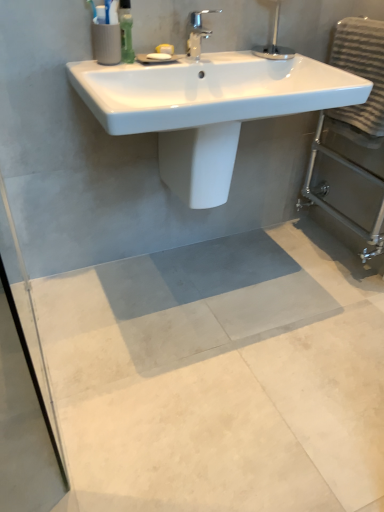
Question: From a real-world perspective, is gray concrete mat at center physically located above or below gray textured towel at right?

Choices:
 (A) below
 (B) above

Answer: (A)

Question: Considering the relative positions of gray concrete mat at center and gray textured towel at right in the image provided, is gray concrete mat at center to the left or to the right of gray textured towel at right?

Choices:
 (A) right
 (B) left

Answer: (B)

Question: Which is farther from the gray textured towel at right?

Choices:
 (A) white glossy sink at upper center
 (B) white glossy bidet at center
 (C) gray concrete mat at center
 (D) chrome metallic faucet at upper center

Answer: (C)

Question: Which object is the farthest from the white glossy bidet at center?

Choices:
 (A) gray concrete mat at center
 (B) gray textured towel at right
 (C) chrome metallic faucet at upper center
 (D) white glossy sink at upper center

Answer: (A)